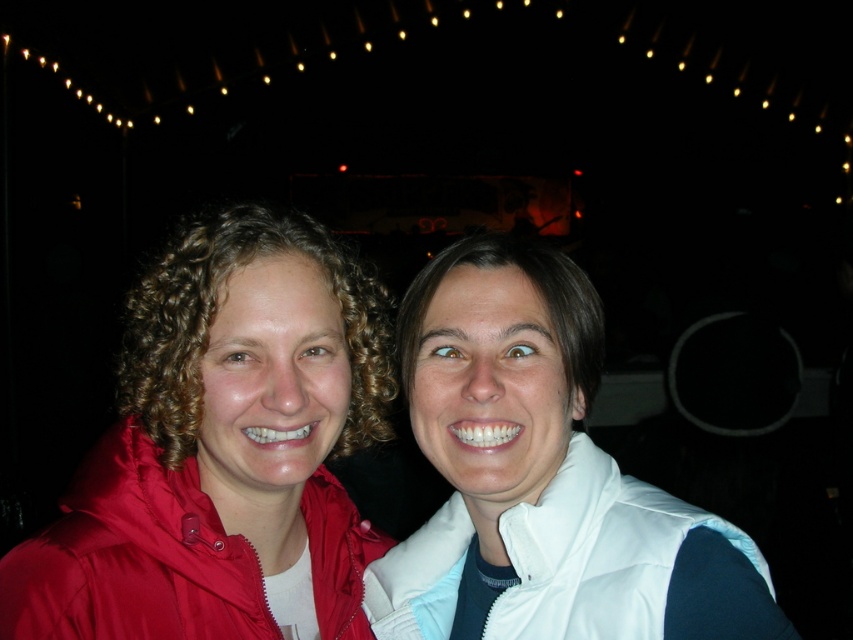
You are standing in a dark area and see a point of light at coordinates point (219,445). What object in the scene corresponds to this point?

The point (219,445) corresponds to the matte red jacket at left.

Consider the image. You are a photographer at a night event and want to capture a closeup shot of both the matte red jacket at left and the white puffy vest at lower right. The camera you are using has a maximum focus range of 12 inches. Will you be able to focus on both subjects at the same time?

The matte red jacket at left and the white puffy vest at lower right are 11.91 inches apart, which is within the camera maximum focus range of 12 inches. Therefore, you can focus on both subjects simultaneously.

You are a photographer setting up a shot for the two people in the image. You want to focus on the matte red jacket at left without blurring the person wearing it. What should you adjust?

→ The matte red jacket at left is 38.93 inches from the camera. To focus on it while keeping the person in focus, adjust the camera focus to 38.93 inches.